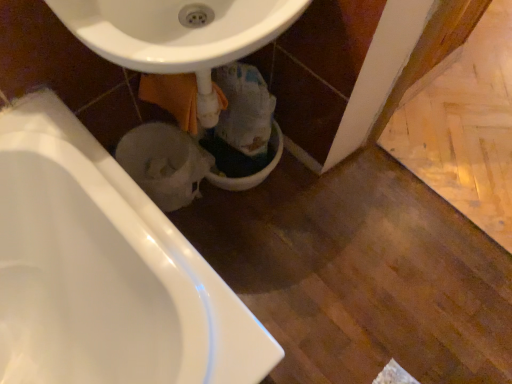
Question: Which direction should I rotate to face white glossy toilet bowl at center, the 2th toilet bowl viewed from the left, — up or down?

Choices:
 (A) down
 (B) up

Answer: (B)

Question: Does white glossy sink at center have a lesser height compared to white glossy toilet bowl at center, the 1th toilet bowl in the right-to-left sequence?

Choices:
 (A) no
 (B) yes

Answer: (A)

Question: Is white glossy sink at center positioned far away from white glossy toilet bowl at center, the 1th toilet bowl in the right-to-left sequence?

Choices:
 (A) yes
 (B) no

Answer: (B)

Question: Considering the relative sizes of white glossy sink at center and white glossy toilet bowl at center, the 1th toilet bowl in the right-to-left sequence, in the image provided, is white glossy sink at center bigger than white glossy toilet bowl at center, the 1th toilet bowl in the right-to-left sequence,?

Choices:
 (A) no
 (B) yes

Answer: (B)

Question: Is white glossy sink at center positioned beyond the bounds of white glossy toilet bowl at center, the 2th toilet bowl viewed from the left?

Choices:
 (A) no
 (B) yes

Answer: (B)

Question: From a real-world perspective, is white glossy sink at center under white glossy toilet bowl at center, the 1th toilet bowl in the right-to-left sequence?

Choices:
 (A) no
 (B) yes

Answer: (A)

Question: Is white glossy sink at center at the left side of white glossy toilet bowl at center, the 2th toilet bowl viewed from the left?

Choices:
 (A) no
 (B) yes

Answer: (B)

Question: Is white glossy toilet bowl at center, the 2th toilet bowl viewed from the left, located within white glossy toilet bowl at lower center, the first toilet bowl from the left?

Choices:
 (A) yes
 (B) no

Answer: (B)

Question: From the image's perspective, is white glossy toilet bowl at lower center, the first toilet bowl from the left, on white glossy toilet bowl at center, the 2th toilet bowl viewed from the left?

Choices:
 (A) no
 (B) yes

Answer: (A)

Question: Is white glossy toilet bowl at lower center, the 2th toilet bowl from the right, oriented away from white glossy toilet bowl at center, the 1th toilet bowl in the right-to-left sequence?

Choices:
 (A) yes
 (B) no

Answer: (B)

Question: Does white glossy toilet bowl at lower center, the first toilet bowl from the left, have a larger size compared to white glossy toilet bowl at center, the 1th toilet bowl in the right-to-left sequence?

Choices:
 (A) yes
 (B) no

Answer: (B)

Question: Considering the relative positions of white glossy toilet bowl at lower center, the first toilet bowl from the left, and white glossy toilet bowl at center, the 1th toilet bowl in the right-to-left sequence, in the image provided, is white glossy toilet bowl at lower center, the first toilet bowl from the left, in front of white glossy toilet bowl at center, the 1th toilet bowl in the right-to-left sequence,?

Choices:
 (A) no
 (B) yes

Answer: (B)

Question: From the image's perspective, is white glossy toilet bowl at lower center, the 2th toilet bowl from the right, below white glossy toilet bowl at center, the 1th toilet bowl in the right-to-left sequence?

Choices:
 (A) yes
 (B) no

Answer: (A)

Question: Can you see white glossy bathtub at lower left touching white glossy toilet bowl at lower center, the 2th toilet bowl from the right?

Choices:
 (A) no
 (B) yes

Answer: (A)